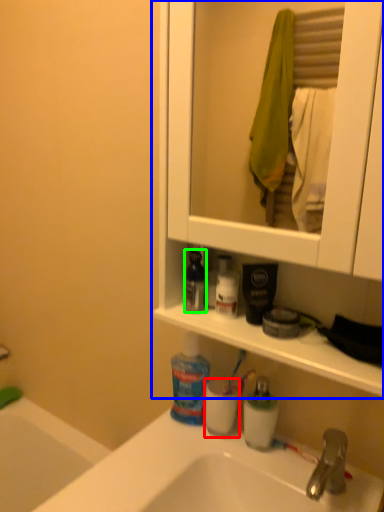
Question: Considering the real-world distances, which object is farthest from mouthwash (highlighted by a red box)? cabinetry (highlighted by a blue box) or mouthwash (highlighted by a green box)?

Choices:
 (A) cabinetry
 (B) mouthwash

Answer: (A)